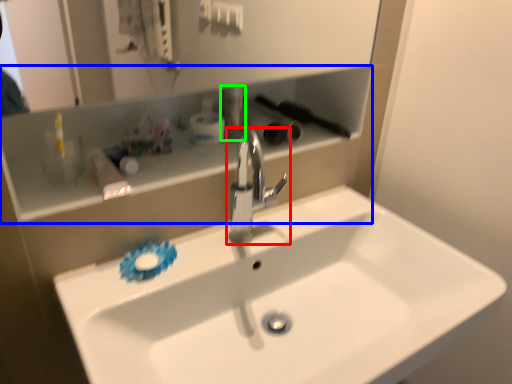
Question: Based on their relative distances, which object is farther from tap (highlighted by a red box)? Choose from shelve (highlighted by a blue box) and toiletry (highlighted by a green box).

Choices:
 (A) shelve
 (B) toiletry

Answer: (A)